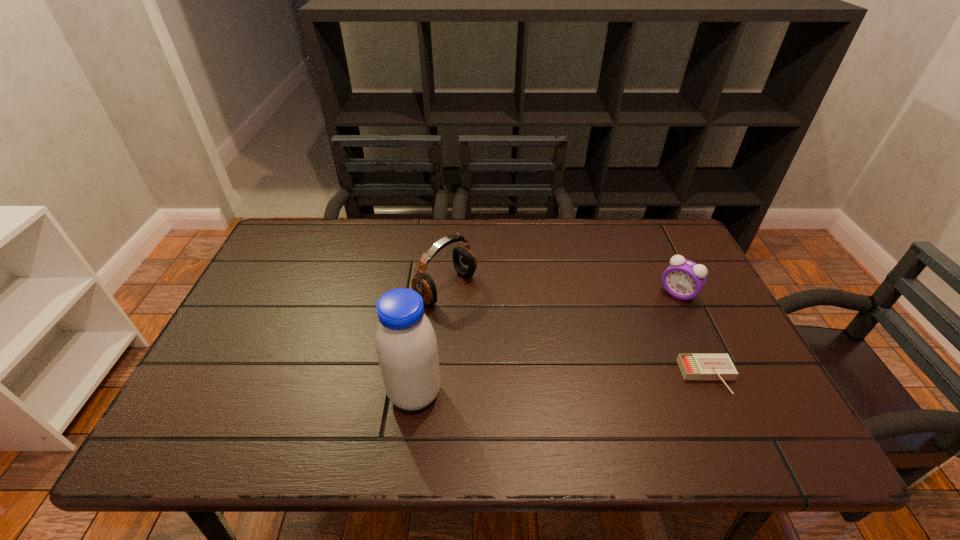
Locate an element on the screen. Image resolution: width=960 pixels, height=540 pixels. free space on the desktop that is between the tallest object and the shortest object and is positioned on the ear cups of the second tallest object is located at coordinates (594, 383).

Where is `free space on the desktop that is between the tallest object and the shortest object and is positioned on the face of the alarm clock`? free space on the desktop that is between the tallest object and the shortest object and is positioned on the face of the alarm clock is located at coordinates (605, 383).